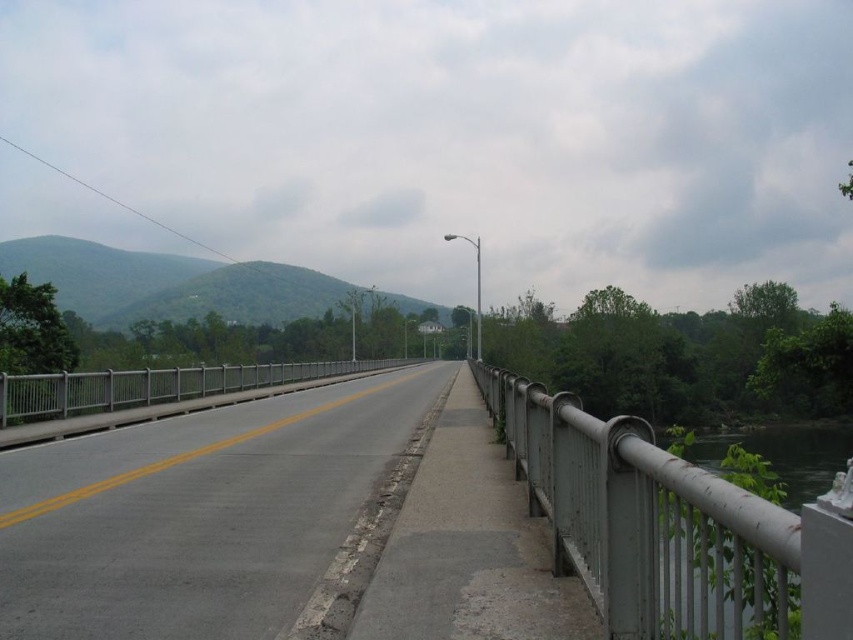
You are a painter planning to restore the bridge. You need to know which railing is shorter to apply the appropriate amount of paint. Which one is shorter between the metallic gray railing at right and the green metallic railing at right?

The metallic gray railing at right is shorter than the green metallic railing at right, so you should apply less paint to the metallic gray railing at right.

You are a hiker standing on the bridge and want to take a photo of the green leafy mountain at upper left and the green metallic railing at right. Which object should you point your camera towards first to capture both in the same frame?

You should point your camera towards the green leafy mountain at upper left first because it is located to the left of the green metallic railing at right, allowing both to be captured in the same frame.

You are a painter hired to repaint the railings on the bridge. You have a limited amount of paint. Which railing, the metallic gray railing at right or the green metallic railing at right, will require less paint because of its size?

The metallic gray railing at right requires less paint because it has a lesser width compared to the green metallic railing at right.